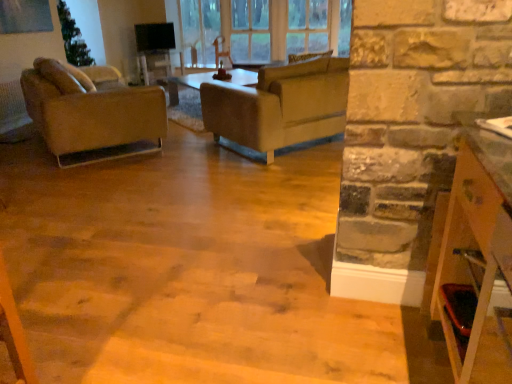
Image resolution: width=512 pixels, height=384 pixels. Identify the location of matte brown leather chair at left. (91, 114).

What do you see at coordinates (261, 29) in the screenshot? I see `clear glass window at upper center` at bounding box center [261, 29].

This screenshot has height=384, width=512. I want to click on clear glass window at upper center, so click(x=261, y=29).

At what (x,y) coordinates should I click in order to perform the action: click on matte brown leather chair at left. Please return your answer as a coordinate pair (x, y). This screenshot has height=384, width=512. Looking at the image, I should click on (91, 114).

Is wooden shelf at right positioned far away from leather couch at center?

That's right, there is a large distance between wooden shelf at right and leather couch at center.

Is point (464, 114) closer to camera compared to point (295, 92)?

Yes.

From the picture: From a real-world perspective, is wooden shelf at right above or below leather couch at center?

From a real-world perspective, wooden shelf at right is physically above leather couch at center.

Is wooden shelf at right smaller than leather couch at center?

Yes, wooden shelf at right is smaller than leather couch at center.

From the picture: Can you confirm if clear glass window at upper center is positioned to the left of matte brown leather chair at left?

Incorrect, clear glass window at upper center is not on the left side of matte brown leather chair at left.

I want to click on chair beneath the clear glass window at upper center (from a real-world perspective), so click(x=91, y=114).

Is clear glass window at upper center in contact with matte brown leather chair at left?

clear glass window at upper center is not next to matte brown leather chair at left, and they're not touching.

Which is behind, point (292, 35) or point (72, 166)?

The point (292, 35) is farther.

Considering the relative sizes of wooden shelf at right and clear glass window at upper center in the image provided, is wooden shelf at right smaller than clear glass window at upper center?

Indeed, wooden shelf at right has a smaller size compared to clear glass window at upper center.

From the image's perspective, is wooden shelf at right located above or below clear glass window at upper center?

Clearly, from the image's perspective, wooden shelf at right is below clear glass window at upper center.

Is wooden shelf at right closer to the viewer compared to clear glass window at upper center?

Yes.

Is clear glass window at upper center a part of wooden shelf at right?

No.

From the image's perspective, which is below, clear glass window at upper center or wooden shelf at right?

From the image's view, wooden shelf at right is below.

Could you tell me if clear glass window at upper center is facing wooden shelf at right?

Yes, clear glass window at upper center faces towards wooden shelf at right.

Is the surface of clear glass window at upper center in direct contact with wooden shelf at right?

No, clear glass window at upper center is not touching wooden shelf at right.

From a real-world perspective, does clear glass window at upper center sit lower than wooden shelf at right?

No.

Considering the sizes of matte brown leather chair at left and leather couch at center in the image, is matte brown leather chair at left wider or thinner than leather couch at center?

In the image, matte brown leather chair at left appears to be more narrow than leather couch at center.

Is matte brown leather chair at left turned away from leather couch at center?

No, matte brown leather chair at left's orientation is not away from leather couch at center.

In the scene shown: Would you consider matte brown leather chair at left to be distant from leather couch at center?

Yes, matte brown leather chair at left and leather couch at center are quite far apart.

From the image's perspective, which is above, matte brown leather chair at left or leather couch at center?

leather couch at center is shown above in the image.

From the picture: Is leather couch at center inside the boundaries of clear glass window at upper center, or outside?

leather couch at center cannot be found inside clear glass window at upper center.

Is leather couch at center next to clear glass window at upper center and touching it?

They are not placed beside each other.

Does leather couch at center come in front of clear glass window at upper center?

Yes, leather couch at center is in front of clear glass window at upper center.

Can you tell me how much leather couch at center and clear glass window at upper center differ in facing direction?

leather couch at center and clear glass window at upper center are facing 129 degrees away from each other.

How different are the orientations of matte brown leather chair at left and clear glass window at upper center in degrees?

matte brown leather chair at left and clear glass window at upper center are facing 138 degrees away from each other.

Can you confirm if matte brown leather chair at left is wider than clear glass window at upper center?

Yes, matte brown leather chair at left is wider than clear glass window at upper center.

Does matte brown leather chair at left touch clear glass window at upper center?

No.

Looking at this image, which is more to the right, matte brown leather chair at left or clear glass window at upper center?

From the viewer's perspective, clear glass window at upper center appears more on the right side.

Find the location of a particular element. This screenshot has height=384, width=512. cabinetry that appears below the leather couch at center (from the image's perspective) is located at coordinates (475, 258).

Identify the location of window behind the matte brown leather chair at left. (261, 29).

In the scene shown: When comparing their distances from wooden shelf at right, does clear glass window at upper center or leather couch at center seem closer?

leather couch at center is closer to wooden shelf at right.

When comparing their distances from clear glass window at upper center, does leather couch at center or wooden shelf at right seem closer?

leather couch at center is closer to clear glass window at upper center.

Considering their positions, is clear glass window at upper center positioned closer to leather couch at center than wooden shelf at right?

clear glass window at upper center.

Looking at the image, which one is located further to clear glass window at upper center, wooden shelf at right or matte brown leather chair at left?

wooden shelf at right.

Which object lies nearer to the anchor point leather couch at center, wooden shelf at right or clear glass window at upper center?

clear glass window at upper center.

Estimate the real-world distances between objects in this image. Which object is closer to leather couch at center, wooden shelf at right or matte brown leather chair at left?

matte brown leather chair at left lies closer to leather couch at center than the other object.

Which object lies nearer to the anchor point matte brown leather chair at left, leather couch at center or clear glass window at upper center?

leather couch at center lies closer to matte brown leather chair at left than the other object.

Looking at the image, which one is located further to matte brown leather chair at left, wooden shelf at right or clear glass window at upper center?

wooden shelf at right is positioned further to the anchor matte brown leather chair at left.

At what (x,y) coordinates should I click in order to perform the action: click on studio couch located between wooden shelf at right and matte brown leather chair at left in the depth direction. Please return your answer as a coordinate pair (x, y). Looking at the image, I should click on (280, 106).

Identify the location of studio couch between wooden shelf at right and clear glass window at upper center in the front-back direction. (280, 106).

Locate an element on the screen. chair between leather couch at center and clear glass window at upper center in the front-back direction is located at coordinates (91, 114).

Locate an element on the screen. This screenshot has height=384, width=512. chair located between wooden shelf at right and clear glass window at upper center in the depth direction is located at coordinates (91, 114).